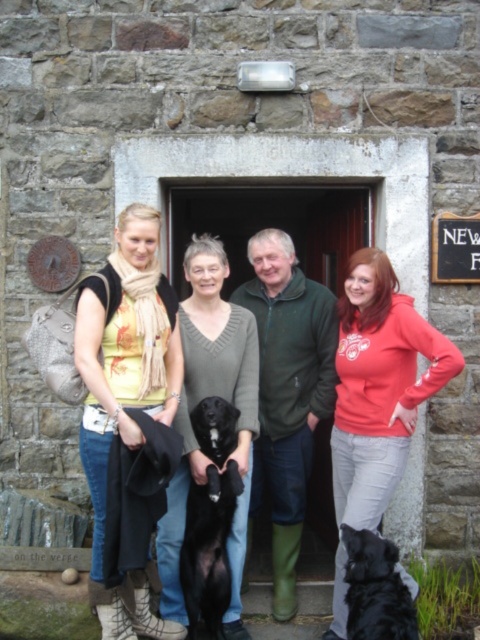
Can you confirm if green matte jacket at center is taller than black glossy dog at center?

Yes, green matte jacket at center is taller than black glossy dog at center.

Which is more to the right, green matte jacket at center or black glossy dog at center?

green matte jacket at center

Is point (312, 337) positioned before point (194, 548)?

That is False.

Where is `green matte jacket at center`? green matte jacket at center is located at coordinates click(287, 396).

Measure the distance between matte black dog at center and camera.

They are 11.99 feet apart.

Who is more forward, (219, 305) or (206, 390)?

Point (206, 390) is in front.

This screenshot has width=480, height=640. Describe the element at coordinates (165, 387) in the screenshot. I see `matte black dog at center` at that location.

Where is `matte black dog at center`? matte black dog at center is located at coordinates (165, 387).

Who is more distant from viewer, (x=120, y=436) or (x=180, y=592)?

Point (x=180, y=592)

Can you confirm if matte yellow top at center is positioned to the right of knitted gray sweater at center?

Incorrect, matte yellow top at center is not on the right side of knitted gray sweater at center.

Which is behind, point (86, 448) or point (175, 518)?

Point (175, 518)

You are a GUI agent. You are given a task and a screenshot of the screen. Output one action in this format:
    pyautogui.click(x=<x>, y=<y>)
    Task: Click on the matte yellow top at center
    The width and height of the screenshot is (480, 640).
    Given the screenshot: What is the action you would take?
    pyautogui.click(x=126, y=390)